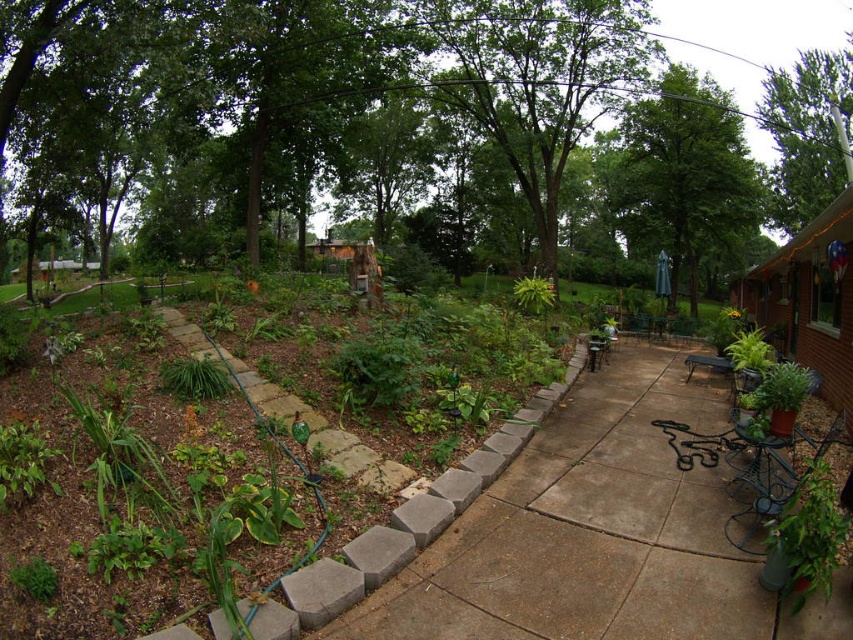
Question: Considering the relative positions of green leafy plant at lower right and green leafy plant at lower left in the image provided, where is green leafy plant at lower right located with respect to green leafy plant at lower left?

Choices:
 (A) left
 (B) right

Answer: (B)

Question: Among these points, which one is farthest from the camera?

Choices:
 (A) (161, 369)
 (B) (642, 385)
 (C) (807, 538)

Answer: (B)

Question: Does brown concrete patio at center appear under green leafy plant at lower right?

Choices:
 (A) no
 (B) yes

Answer: (B)

Question: Is brown concrete patio at center to the left of green leafy plant at lower right from the viewer's perspective?

Choices:
 (A) no
 (B) yes

Answer: (B)

Question: Considering the real-world distances, which object is closest to the green leafy plant at lower right?

Choices:
 (A) green leafy plant at lower left
 (B) brown concrete patio at center

Answer: (B)

Question: Which point is farther to the camera?

Choices:
 (A) green leafy plant at lower right
 (B) green leafy plant at lower left

Answer: (B)